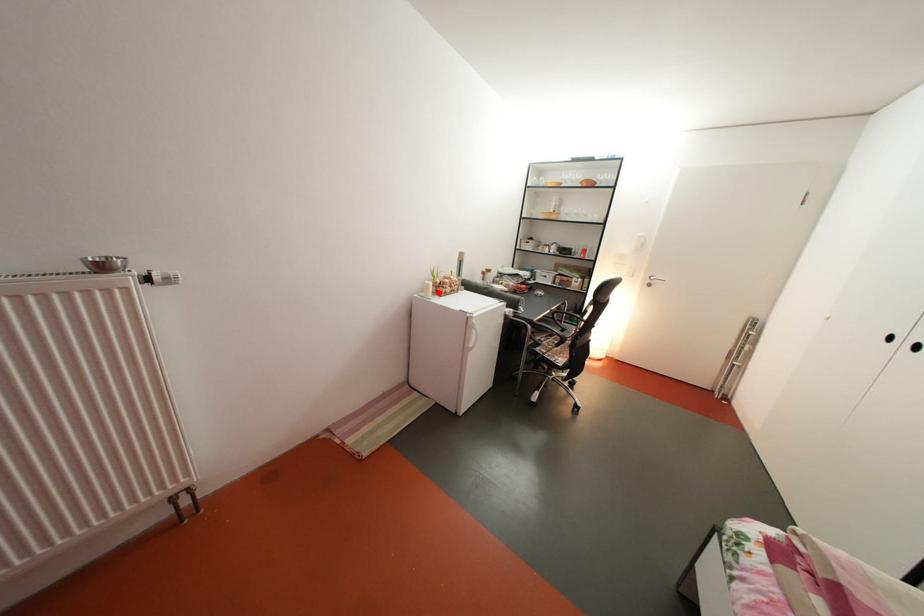
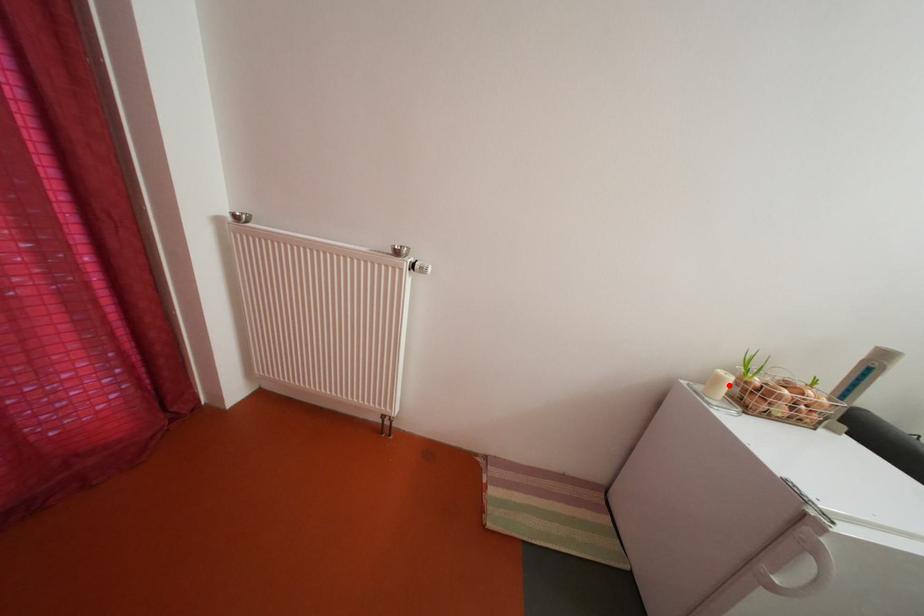
I am providing you with two images of the same scene from different viewpoints. A red point is marked on the first image and another point is marked on the second image. Is the marked point in image1 the same physical position as the marked point in image2?

Yes